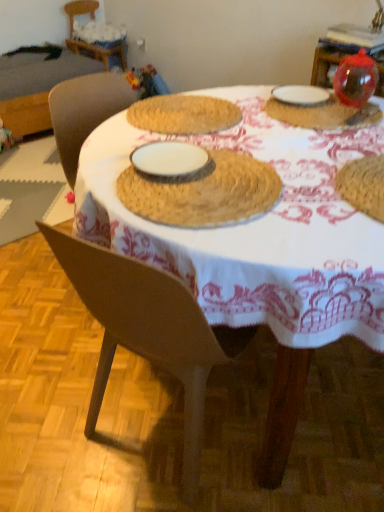
Identify the location of free spot to the left of white ceramic plate at upper right, marked as the 3th tableware in a right-to-left arrangement. The height and width of the screenshot is (512, 384). (255, 103).